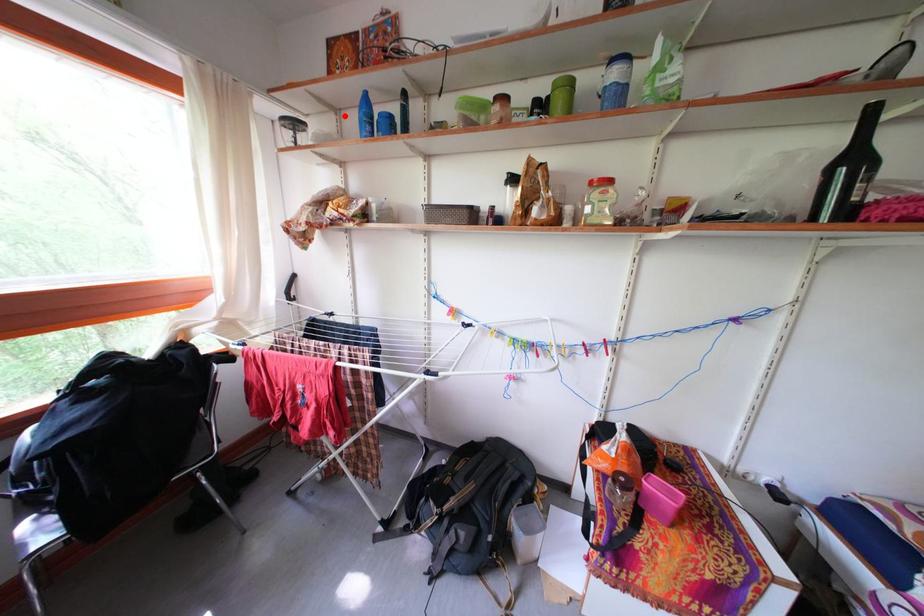
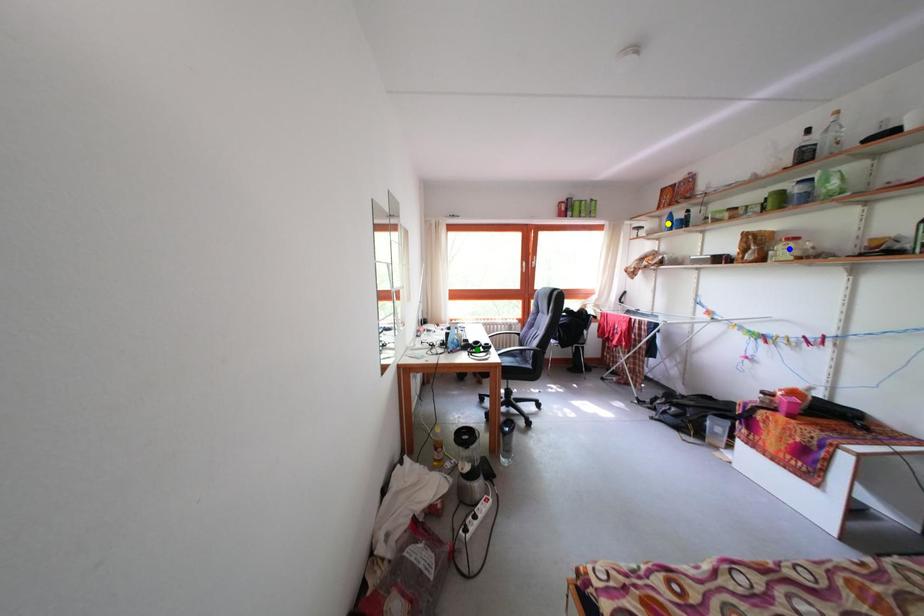
Question: I am providing you with two images of the same scene from different viewpoints. A red point is marked on the first image. You are given multiple points on the second image. Which mark in image 2 goes with the point in image 1?

Choices:
 (A) yellow point
 (B) blue point
 (C) green point

Answer: (A)